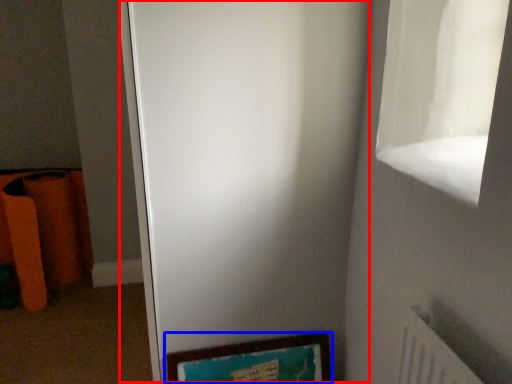
Question: Among these objects, which one is farthest to the camera, screen door (highlighted by a red box) or picture frame (highlighted by a blue box)?

Choices:
 (A) screen door
 (B) picture frame

Answer: (B)